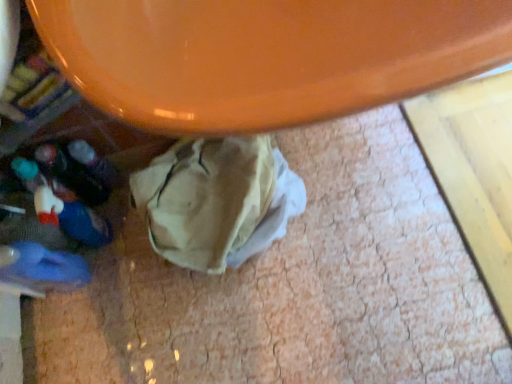
Question: Is orange glossy table at upper center bigger or smaller than blue rubber slipper at lower left?

Choices:
 (A) big
 (B) small

Answer: (A)

Question: Does point (58, 43) appear closer or farther from the camera than point (39, 253)?

Choices:
 (A) closer
 (B) farther

Answer: (A)

Question: From their relative heights in the image, would you say orange glossy table at upper center is taller or shorter than blue rubber slipper at lower left?

Choices:
 (A) short
 (B) tall

Answer: (A)

Question: Considering the positions of blue rubber slipper at lower left and orange glossy table at upper center in the image, is blue rubber slipper at lower left wider or thinner than orange glossy table at upper center?

Choices:
 (A) wide
 (B) thin

Answer: (B)

Question: From the image's perspective, is blue rubber slipper at lower left positioned above or below orange glossy table at upper center?

Choices:
 (A) above
 (B) below

Answer: (B)

Question: Is point (47, 276) closer or farther from the camera than point (355, 104)?

Choices:
 (A) closer
 (B) farther

Answer: (B)

Question: Considering the relative positions of blue rubber slipper at lower left and orange glossy table at upper center in the image provided, is blue rubber slipper at lower left to the left or to the right of orange glossy table at upper center?

Choices:
 (A) left
 (B) right

Answer: (A)